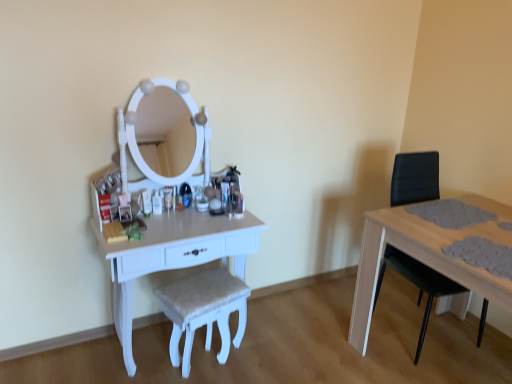
Question: Is white glossy table at left at the back of black leather swivel chair at right?

Choices:
 (A) no
 (B) yes

Answer: (A)

Question: From the image's perspective, is black leather swivel chair at right below white glossy table at left?

Choices:
 (A) yes
 (B) no

Answer: (B)

Question: From the image's perspective, is black leather swivel chair at right on top of white glossy table at left?

Choices:
 (A) yes
 (B) no

Answer: (A)

Question: Considering the relative positions of black leather swivel chair at right and white glossy table at left in the image provided, is black leather swivel chair at right to the right of white glossy table at left from the viewer's perspective?

Choices:
 (A) yes
 (B) no

Answer: (A)

Question: Is black leather swivel chair at right aimed at white glossy table at left?

Choices:
 (A) no
 (B) yes

Answer: (A)

Question: Does black leather swivel chair at right have a lesser height compared to white glossy table at left?

Choices:
 (A) yes
 (B) no

Answer: (B)

Question: Is white glossy table at left oriented towards black leather swivel chair at right?

Choices:
 (A) no
 (B) yes

Answer: (A)

Question: Would you say white glossy table at left is a long distance from black leather swivel chair at right?

Choices:
 (A) yes
 (B) no

Answer: (A)

Question: Is white glossy table at left surrounding black leather swivel chair at right?

Choices:
 (A) no
 (B) yes

Answer: (A)

Question: Are white glossy table at left and black leather swivel chair at right beside each other?

Choices:
 (A) no
 (B) yes

Answer: (A)

Question: From a real-world perspective, is white glossy table at left on top of black leather swivel chair at right?

Choices:
 (A) no
 (B) yes

Answer: (A)

Question: From the image's perspective, is white glossy table at left located above black leather swivel chair at right?

Choices:
 (A) yes
 (B) no

Answer: (B)

Question: Considering the relative sizes of white textured stool at center and white glossy table at left in the image provided, is white textured stool at center thinner than white glossy table at left?

Choices:
 (A) yes
 (B) no

Answer: (A)